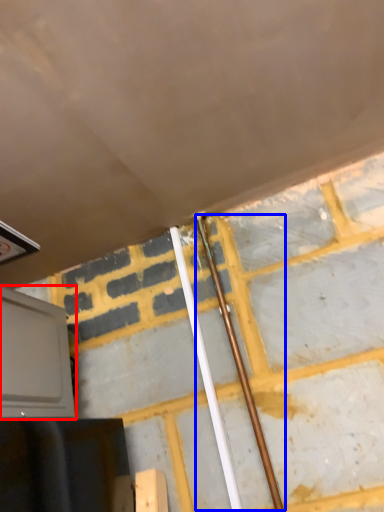
Question: Which object is further to the camera taking this photo, oven (highlighted by a red box) or beam (highlighted by a blue box)?

Choices:
 (A) oven
 (B) beam

Answer: (B)